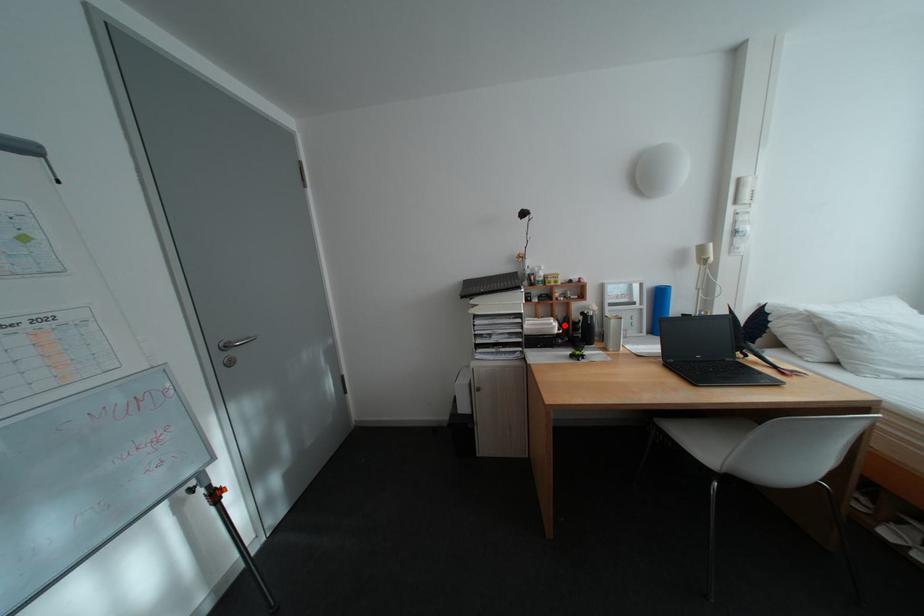
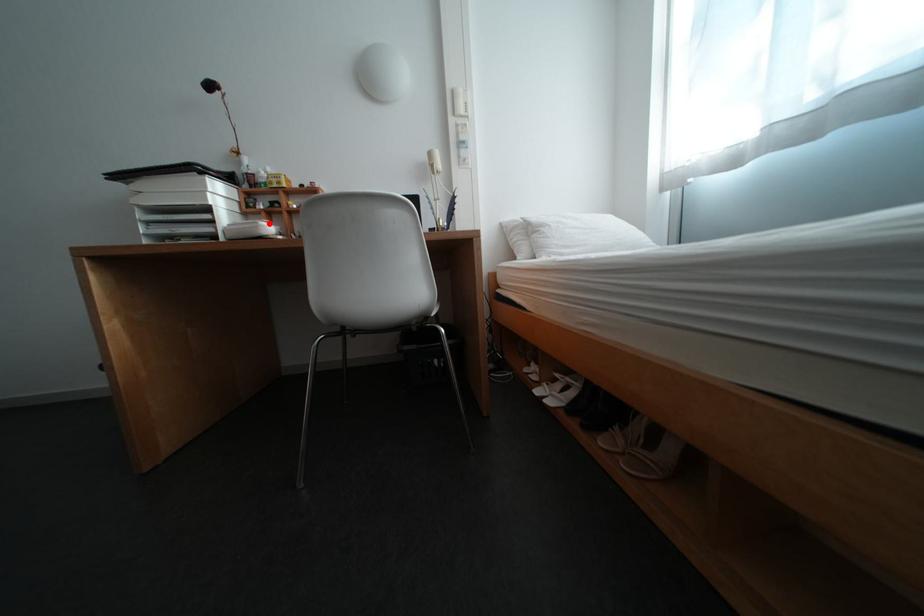
Based on the photo, I am providing you with two images of the same scene from different viewpoints. A red point is marked on the first image and another point is marked on the second image. Is the marked point in image1 the same physical position as the marked point in image2?

Yes